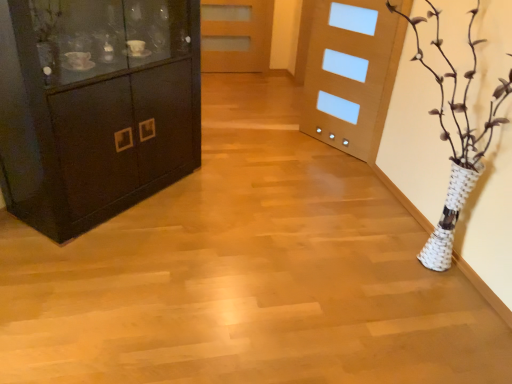
Find the location of a particular element. This screenshot has width=512, height=384. matte wood door at center is located at coordinates (236, 35).

The width and height of the screenshot is (512, 384). Describe the element at coordinates (236, 35) in the screenshot. I see `matte wood door at center` at that location.

What are the coordinates of `matte black cabinet at left` in the screenshot? It's located at (95, 107).

This screenshot has height=384, width=512. What do you see at coordinates (95, 107) in the screenshot? I see `matte black cabinet at left` at bounding box center [95, 107].

Where is `matte wood door at center`? This screenshot has height=384, width=512. matte wood door at center is located at coordinates (x=236, y=35).

Visually, is matte black cabinet at left positioned to the left or to the right of matte wood door at center?

Clearly, matte black cabinet at left is on the left of matte wood door at center in the image.

Is matte black cabinet at left closer to the viewer compared to matte wood door at center?

Yes, matte black cabinet at left is closer to the viewer.

Which is behind, point (162, 116) or point (236, 67)?

The point (236, 67) is farther from the camera.

From the picture: From the image's perspective, which one is positioned higher, matte black cabinet at left or matte wood door at center?

matte wood door at center is shown above in the image.

From a real-world perspective, between matte black cabinet at left and matte wood door at center, who is vertically higher?

In real-world perspective, matte black cabinet at left is above.

From the picture: Considering the sizes of matte black cabinet at left and matte wood door at center in the image, is matte black cabinet at left wider or thinner than matte wood door at center?

Clearly, matte black cabinet at left has more width compared to matte wood door at center.

Which of these two, matte black cabinet at left or matte wood door at center, stands taller?

matte black cabinet at left is taller.

Can you confirm if matte black cabinet at left is smaller than matte wood door at center?

No, matte black cabinet at left is not smaller than matte wood door at center.

Does matte black cabinet at left contain matte wood door at center?

No, matte wood door at center is not inside matte black cabinet at left.

Is matte black cabinet at left positioned far away from matte wood door at center?

Indeed, matte black cabinet at left is not near matte wood door at center.

Is matte wood door at center at the back of matte black cabinet at left?

No, matte wood door at center is not at the back of matte black cabinet at left.

How many degrees apart are the facing directions of matte black cabinet at left and matte wood door at center?

The angle between the facing direction of matte black cabinet at left and the facing direction of matte wood door at center is 43.3 degrees.

You are a GUI agent. You are given a task and a screenshot of the screen. Output one action in this format:
    pyautogui.click(x=<x>, y=<y>)
    Task: Click on the door located underneath the matte black cabinet at left (from a real-world perspective)
    The height and width of the screenshot is (384, 512).
    Given the screenshot: What is the action you would take?
    pyautogui.click(x=236, y=35)

Which is more to the left, matte wood door at center or matte black cabinet at left?

Positioned to the left is matte black cabinet at left.

From the picture: Is matte wood door at center behind matte black cabinet at left?

Yes, matte wood door at center is further from the camera.

Which point is more forward, [258,16] or [53,187]?

The point [53,187] is closer to the camera.

From the image's perspective, is matte wood door at center located above or below matte black cabinet at left?

matte wood door at center is above matte black cabinet at left.

From a real-world perspective, is matte wood door at center positioned under matte black cabinet at left based on gravity?

Yes, from a real-world perspective, matte wood door at center is below matte black cabinet at left.

Considering the sizes of objects matte wood door at center and matte black cabinet at left in the image provided, who is wider, matte wood door at center or matte black cabinet at left?

Wider between the two is matte black cabinet at left.

Is matte wood door at center shorter than matte black cabinet at left?

Correct, matte wood door at center is not as tall as matte black cabinet at left.

In terms of size, does matte wood door at center appear bigger or smaller than matte black cabinet at left?

Clearly, matte wood door at center is smaller in size than matte black cabinet at left.

Is matte wood door at center positioned beyond the bounds of matte black cabinet at left?

Absolutely, matte wood door at center is external to matte black cabinet at left.

Consider the image. Is matte wood door at center with matte black cabinet at left?

matte wood door at center and matte black cabinet at left are clearly separated.

Could you tell me if matte wood door at center is facing matte black cabinet at left?

Yes, matte wood door at center is aimed at matte black cabinet at left.

Identify the location of door above the matte black cabinet at left (from the image's perspective). (236, 35).

In the image, there is a matte black cabinet at left. Identify the location of door above it (from the image's perspective). Image resolution: width=512 pixels, height=384 pixels. (236, 35).

I want to click on door below the matte black cabinet at left (from a real-world perspective), so click(236, 35).